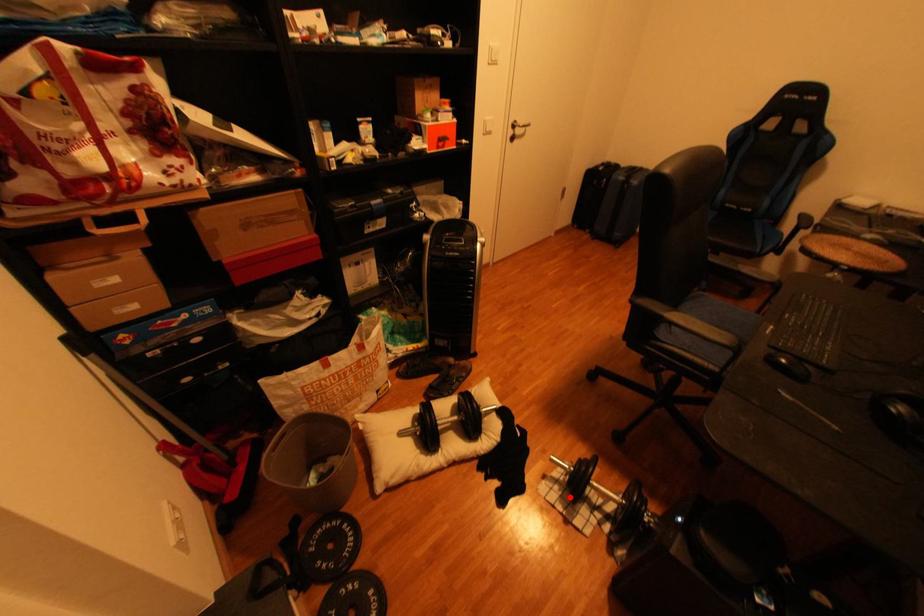
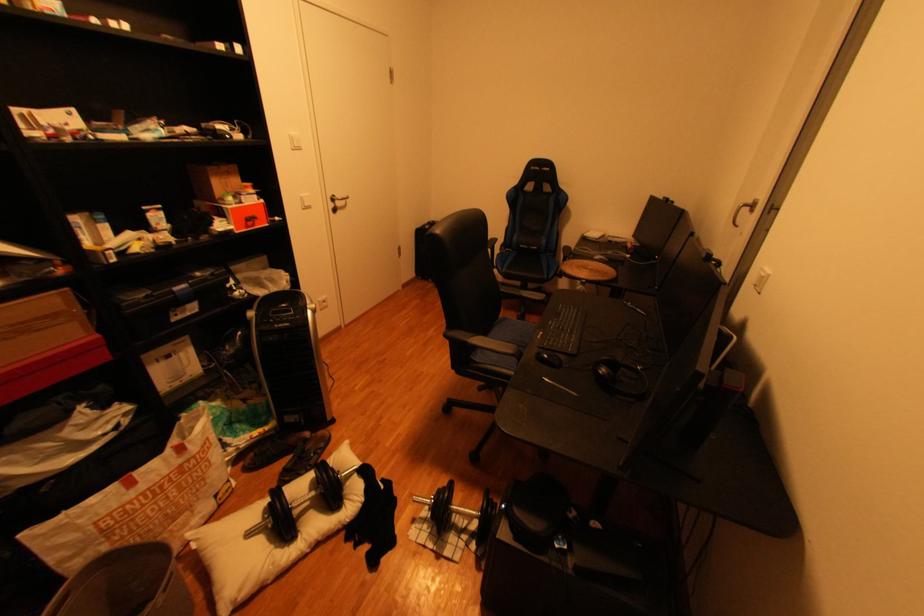
Question: I am providing you with two images of the same scene from different viewpoints. A red point is marked on the first image. At the location where the point appears in image 1, is it still visible in image 2?

Choices:
 (A) Yes
 (B) No

Answer: (A)